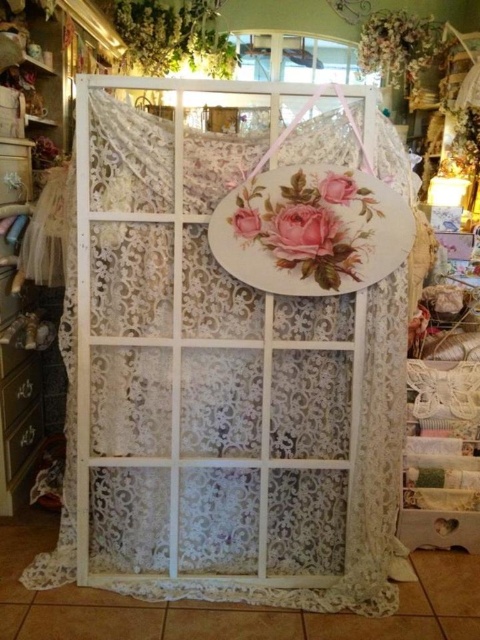
Question: Which object is farther from the camera taking this photo?

Choices:
 (A) white lace curtain at center
 (B) matte pink rose at center
 (C) matte pink floral at center
 (D) matte pink floral panel at center

Answer: (B)

Question: Is matte pink rose at center above matte pink floral at center?

Choices:
 (A) yes
 (B) no

Answer: (B)

Question: Can you confirm if matte pink rose at center is positioned above matte pink floral at center?

Choices:
 (A) no
 (B) yes

Answer: (A)

Question: Which of the following is the closest to the observer?

Choices:
 (A) matte pink floral at center
 (B) white lace curtain at upper center

Answer: (A)

Question: Is white lace curtain at upper center closer to camera compared to matte pink rose at center?

Choices:
 (A) yes
 (B) no

Answer: (B)

Question: Which point is farther to the camera?

Choices:
 (A) (275, 214)
 (B) (429, 19)

Answer: (B)